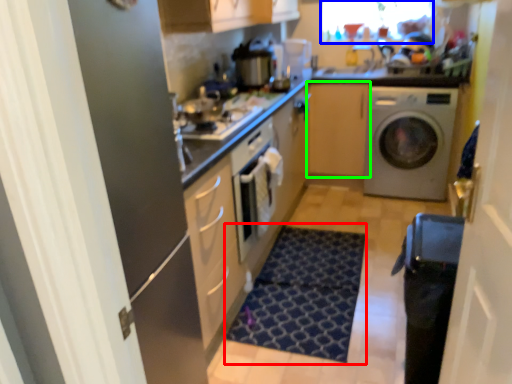
Question: Considering the real-world distances, which object is closest to doormat (highlighted by a red box)? window screen (highlighted by a blue box) or cabinetry (highlighted by a green box).

Choices:
 (A) window screen
 (B) cabinetry

Answer: (B)